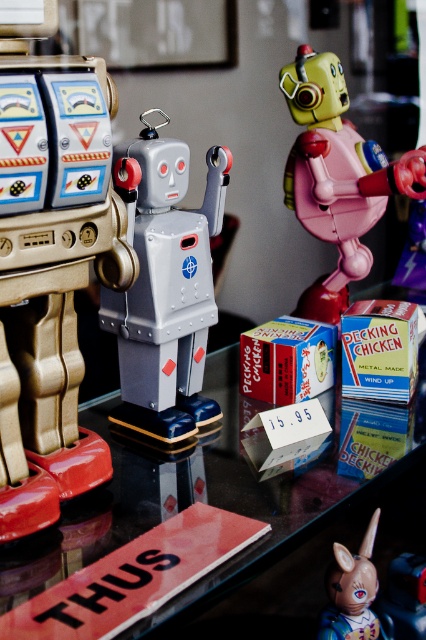
You are looking at the vintage toys on the glass table. There are two points marked in the scene. One is at coordinates point (184, 212) and the other at point (374, 586). From your perspective, which point is closer to you?

Point (374, 586) is closer to you because point (184, 212) is behind it.

Based on the photo, you are positioning a new toy on a glass table and need to place it exactly where the gold metallic robot at left is currently located. What are the coordinates of the spot where you should place the new toy?

The coordinates for the gold metallic robot at left are at point [54,289], so you should place the new toy there.

You are a toy collector who wants to place a new 12 inch tall teddy bear between the gold metallic robot at left and the matte plastic unicorn at lower right on the table. Can the teddy bear fit between them without overlapping either toy?

The distance between the gold metallic robot at left and the matte plastic unicorn at lower right is 18.72 inches. Since the teddy bear is 12 inches tall, it can fit between them as the space is larger than the teddy bear.